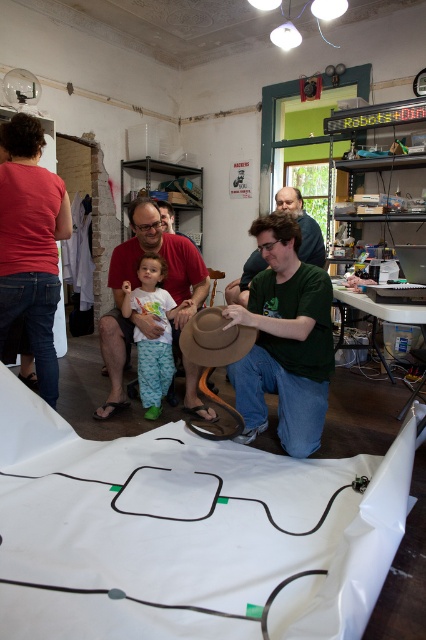
Question: Which of the following is the farthest from the observer?

Choices:
 (A) brown leather hat at center
 (B) brown felt cowboy hat at center
 (C) matte red shirt at center
 (D) green matte hat at center

Answer: (A)

Question: Does green matte hat at center have a lesser width compared to green matte shirt at center?

Choices:
 (A) yes
 (B) no

Answer: (A)

Question: Which point is closer to the camera taking this photo?

Choices:
 (A) (278, 340)
 (B) (233, 300)
 (C) (222, 340)
 (D) (172, 371)

Answer: (C)

Question: Is green matte hat at center thinner than matte red shirt at center?

Choices:
 (A) yes
 (B) no

Answer: (A)

Question: Does green matte hat at center appear over matte red shirt at center?

Choices:
 (A) no
 (B) yes

Answer: (A)

Question: Estimate the real-world distances between objects in this image. Which object is closer to the matte red shirt at center?

Choices:
 (A) brown felt cowboy hat at center
 (B) green matte hat at center

Answer: (B)